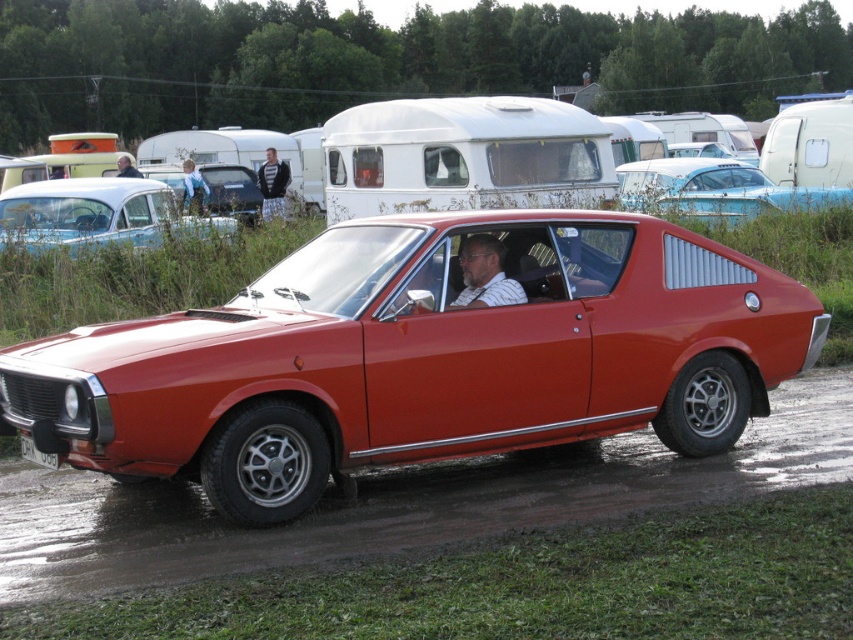
Question: Which of the following is the closest to the observer?

Choices:
 (A) (109, 212)
 (B) (274, 211)
 (C) (323, 556)
 (D) (691, 180)

Answer: (C)

Question: Does dirt track at lower center have a greater width compared to plaid fabric pants at center?

Choices:
 (A) no
 (B) yes

Answer: (B)

Question: Which point appears farthest from the camera in this image?

Choices:
 (A) (503, 280)
 (B) (457, 467)
 (C) (666, 355)
 (D) (55, 189)

Answer: (D)

Question: Can you confirm if striped fabric shirt at center is positioned to the right of plaid fabric pants at center?

Choices:
 (A) yes
 (B) no

Answer: (A)

Question: Which of these objects is positioned farthest from the matte black car at upper center?

Choices:
 (A) blue denim jeans at center
 (B) striped fabric shirt at center
 (C) shiny red car at center
 (D) plaid fabric pants at center

Answer: (B)

Question: Can you confirm if light blue metallic car at upper right is bigger than striped fabric shirt at center?

Choices:
 (A) no
 (B) yes

Answer: (A)